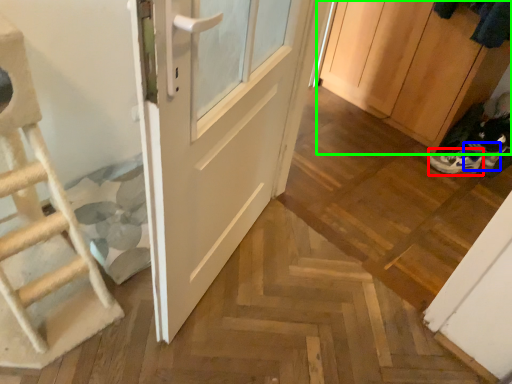
Question: Which object is positioned closest to footwear (highlighted by a red box)? Select from shoe (highlighted by a blue box) and cabinetry (highlighted by a green box).

Choices:
 (A) shoe
 (B) cabinetry

Answer: (A)